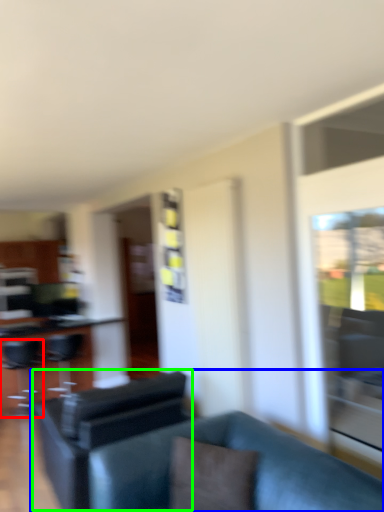
Question: Considering the real-world distances, which object is closest to swivel chair (highlighted by a red box)? studio couch (highlighted by a blue box) or swivel chair (highlighted by a green box).

Choices:
 (A) studio couch
 (B) swivel chair

Answer: (B)